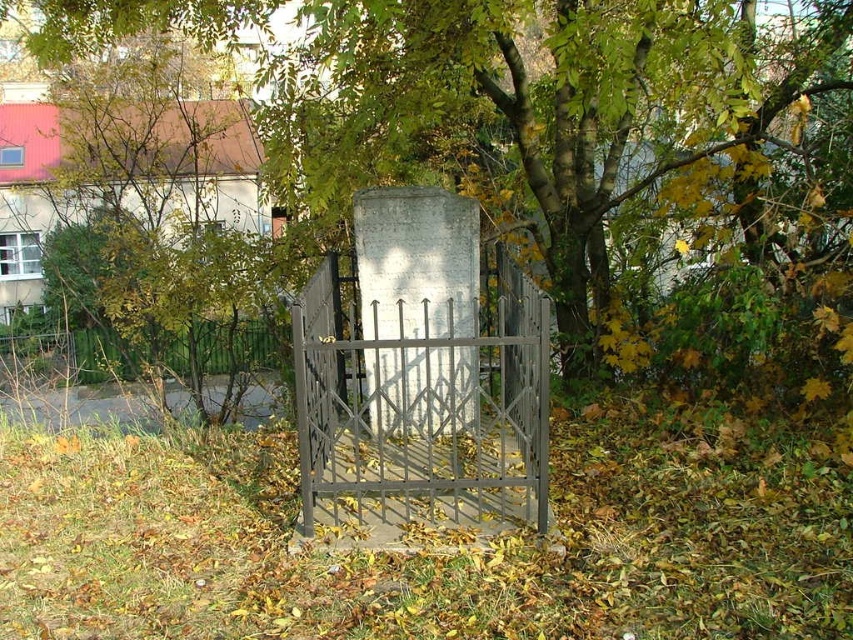
You are a gardener who needs to trim the green leafy tree at center. The gate must remain intact. Since the tree is above the gate, can you safely trim the branches without damaging the dark gray wrought iron gate at center?

The green leafy tree at center is located above the dark gray wrought iron gate at center, so trimming the branches above the gate would not damage it. However, branches hanging over the gate must be carefully trimmed to avoid contact with the gate structure.

You are a painter who wants to capture the scene of the green leafy tree at center and the dark gray wrought iron gate at center in your painting. Which object should you draw first if you want to follow the rule of drawing thinner objects before thicker ones?

The green leafy tree at center is thinner than the dark gray wrought iron gate at center, so you should draw the green leafy tree at center first.

Consider the image. You are standing at point A, which is at coordinates point (x=283, y=182). You want to walk to point B, located at point (x=357, y=502). However, there is a metal gate blocking your path. Can you walk directly from point A to point B without going around the gate?

Point (x=283, y=182) is behind point (x=357, y=502), so you cannot walk directly from point A to point B without going around the gate because point A is behind point B relative to your position.